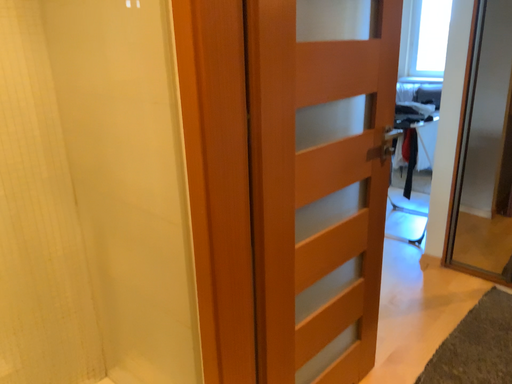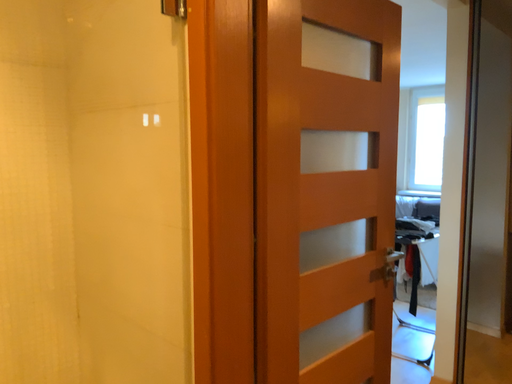
Question: Which way did the camera rotate in the video?

Choices:
 (A) rotated upward
 (B) rotated downward

Answer: (A)